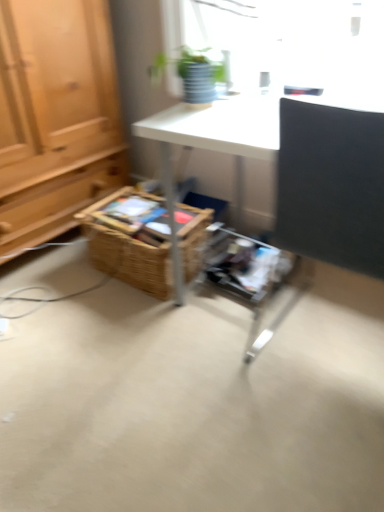
Question: Can you confirm if woven brown basket at center is thinner than matte black desk at right?

Choices:
 (A) no
 (B) yes

Answer: (B)

Question: Considering the relative sizes of woven brown basket at center and matte black desk at right in the image provided, is woven brown basket at center taller than matte black desk at right?

Choices:
 (A) no
 (B) yes

Answer: (A)

Question: Is matte black desk at right a part of woven brown basket at center?

Choices:
 (A) yes
 (B) no

Answer: (B)

Question: Is woven brown basket at center to the right of matte black desk at right from the viewer's perspective?

Choices:
 (A) no
 (B) yes

Answer: (A)

Question: Are woven brown basket at center and matte black desk at right making contact?

Choices:
 (A) yes
 (B) no

Answer: (B)

Question: From the image's perspective, is woven brown basket at center above or below green matte plant at upper center?

Choices:
 (A) below
 (B) above

Answer: (A)

Question: In terms of size, does woven brown basket at center appear bigger or smaller than green matte plant at upper center?

Choices:
 (A) big
 (B) small

Answer: (A)

Question: Is woven brown basket at center taller or shorter than green matte plant at upper center?

Choices:
 (A) short
 (B) tall

Answer: (B)

Question: Considering the relative positions of woven brown basket at center and green matte plant at upper center in the image provided, is woven brown basket at center to the left or to the right of green matte plant at upper center?

Choices:
 (A) right
 (B) left

Answer: (B)

Question: From their relative heights in the image, would you say matte black desk at right is taller or shorter than green matte plant at upper center?

Choices:
 (A) short
 (B) tall

Answer: (B)

Question: From the image's perspective, is matte black desk at right above or below green matte plant at upper center?

Choices:
 (A) below
 (B) above

Answer: (A)

Question: In terms of width, does matte black desk at right look wider or thinner when compared to green matte plant at upper center?

Choices:
 (A) thin
 (B) wide

Answer: (B)

Question: Is matte black desk at right bigger or smaller than green matte plant at upper center?

Choices:
 (A) big
 (B) small

Answer: (A)

Question: Does point (206, 60) appear closer or farther from the camera than point (370, 246)?

Choices:
 (A) farther
 (B) closer

Answer: (A)

Question: From the image's perspective, is green matte plant at upper center positioned above or below matte black desk at right?

Choices:
 (A) below
 (B) above

Answer: (B)